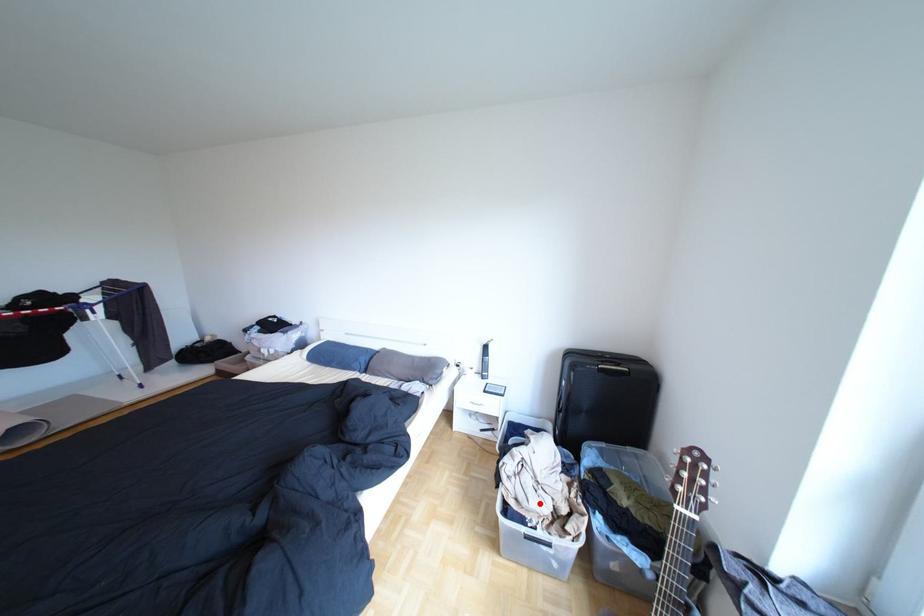
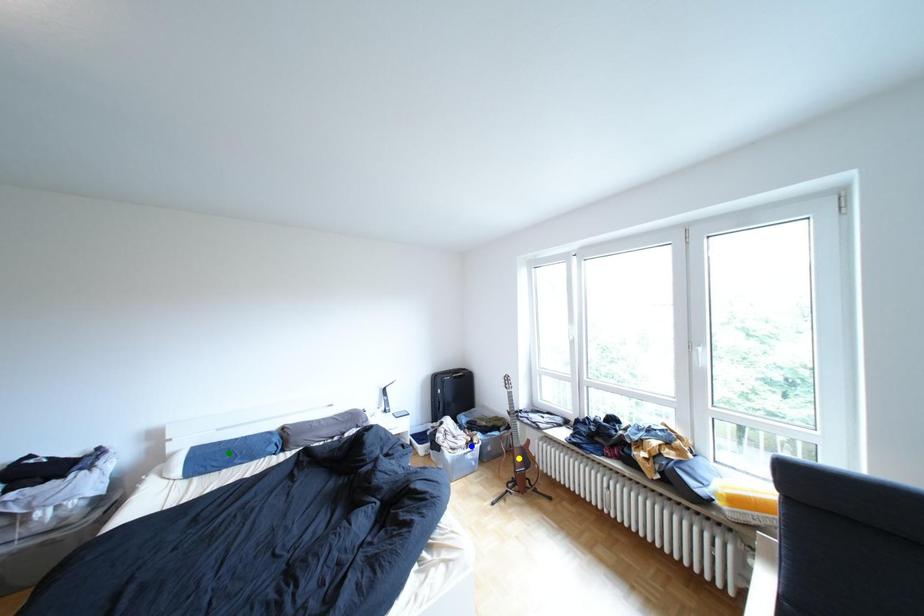
Question: I am providing you with two images of the same scene from different viewpoints. A red point is marked on the first image. You are given multiple points on the second image. Which mark in image 2 goes with the point in image 1?

Choices:
 (A) blue point
 (B) yellow point
 (C) green point

Answer: (A)